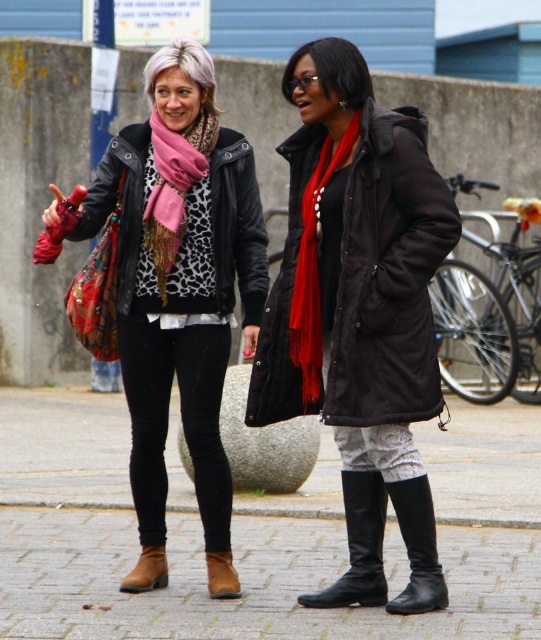
Question: Which point appears closest to the camera in this image?

Choices:
 (A) (155, 241)
 (B) (311, 337)
 (C) (365, 476)
 (D) (213, 557)

Answer: (D)

Question: Which object appears farthest from the camera in this image?

Choices:
 (A) matte black coat at center
 (B) brick pavement at center
 (C) red matte scarf at center
 (D) matte black jacket at center

Answer: (D)

Question: Considering the relative positions of matte black jacket at center and black leather boot at lower right in the image provided, where is matte black jacket at center located with respect to black leather boot at lower right?

Choices:
 (A) right
 (B) left

Answer: (B)

Question: Which of the following is the farthest from the observer?

Choices:
 (A) black leather boot at lower center
 (B) matte black jacket at center
 (C) brown suede boot at lower left
 (D) brick pavement at center

Answer: (B)

Question: Does red matte scarf at center have a smaller size compared to leather boot at lower left?

Choices:
 (A) no
 (B) yes

Answer: (A)

Question: Can you confirm if pink leopard print scarf at upper left is bigger than black leather boot at lower center?

Choices:
 (A) yes
 (B) no

Answer: (A)